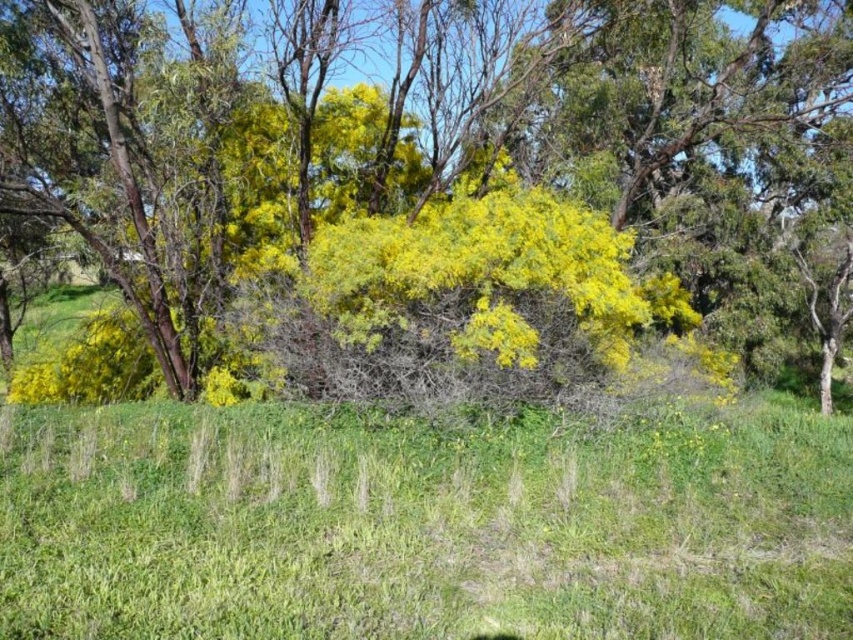
Can you confirm if yellow-green foliage at center is positioned to the left of green grassy at center?

Incorrect, yellow-green foliage at center is not on the left side of green grassy at center.

Does yellow-green foliage at center appear over green grassy at center?

Correct, yellow-green foliage at center is located above green grassy at center.

Between point (70, 131) and point (483, 480), which one is positioned in front?

Point (483, 480)

You are a GUI agent. You are given a task and a screenshot of the screen. Output one action in this format:
    pyautogui.click(x=<x>, y=<y>)
    Task: Click on the yellow-green foliage at center
    This screenshot has height=640, width=853.
    Given the screenshot: What is the action you would take?
    pyautogui.click(x=453, y=170)